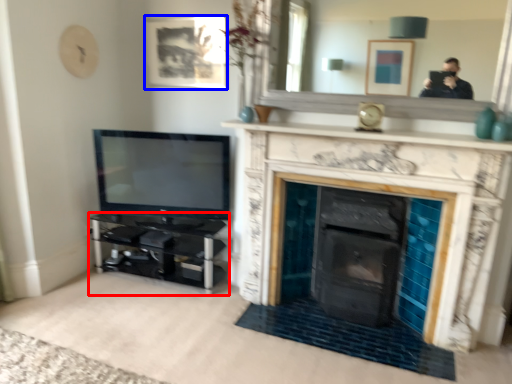
Question: Which point is closer to the camera, entertainment center (highlighted by a red box) or picture frame (highlighted by a blue box)?

Choices:
 (A) entertainment center
 (B) picture frame

Answer: (A)